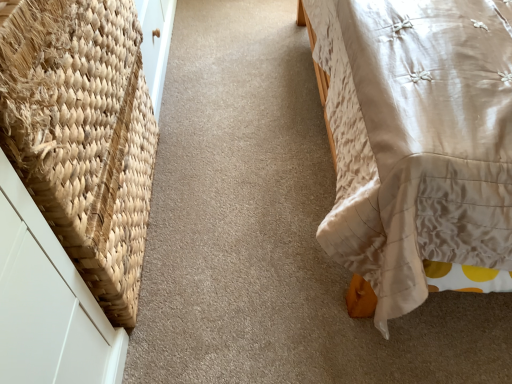
Question: Does white satin bed at right have a smaller size compared to natural woven basket at left?

Choices:
 (A) no
 (B) yes

Answer: (A)

Question: Is white satin bed at right completely or partially outside of natural woven basket at left?

Choices:
 (A) no
 (B) yes

Answer: (B)

Question: Considering the relative sizes of white satin bed at right and natural woven basket at left in the image provided, is white satin bed at right wider than natural woven basket at left?

Choices:
 (A) yes
 (B) no

Answer: (A)

Question: From the image's perspective, is white satin bed at right below natural woven basket at left?

Choices:
 (A) no
 (B) yes

Answer: (A)

Question: From a real-world perspective, is white satin bed at right under natural woven basket at left?

Choices:
 (A) yes
 (B) no

Answer: (B)

Question: Is white satin bed at right with natural woven basket at left?

Choices:
 (A) no
 (B) yes

Answer: (A)

Question: Is natural woven basket at left oriented away from white satin bed at right?

Choices:
 (A) no
 (B) yes

Answer: (A)

Question: From a real-world perspective, does natural woven basket at left stand above white satin bed at right?

Choices:
 (A) no
 (B) yes

Answer: (A)

Question: Is natural woven basket at left bigger than white satin bed at right?

Choices:
 (A) no
 (B) yes

Answer: (A)

Question: Is white satin bed at right inside natural woven basket at left?

Choices:
 (A) no
 (B) yes

Answer: (A)

Question: Does natural woven basket at left appear on the right side of white satin bed at right?

Choices:
 (A) yes
 (B) no

Answer: (B)

Question: From the image's perspective, is natural woven basket at left on white satin bed at right?

Choices:
 (A) yes
 (B) no

Answer: (B)

Question: From a real-world perspective, is white satin bed at right above or below natural woven basket at left?

Choices:
 (A) above
 (B) below

Answer: (A)